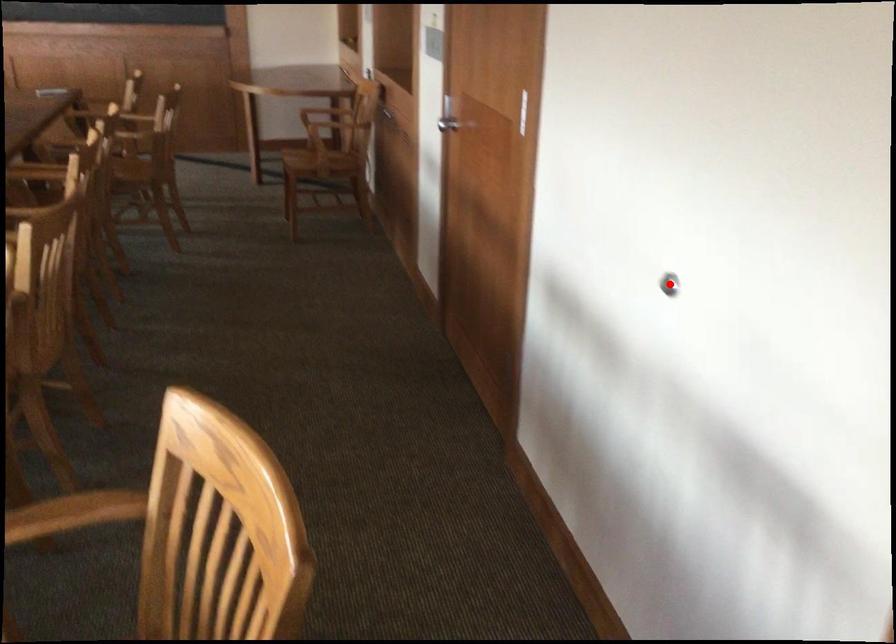
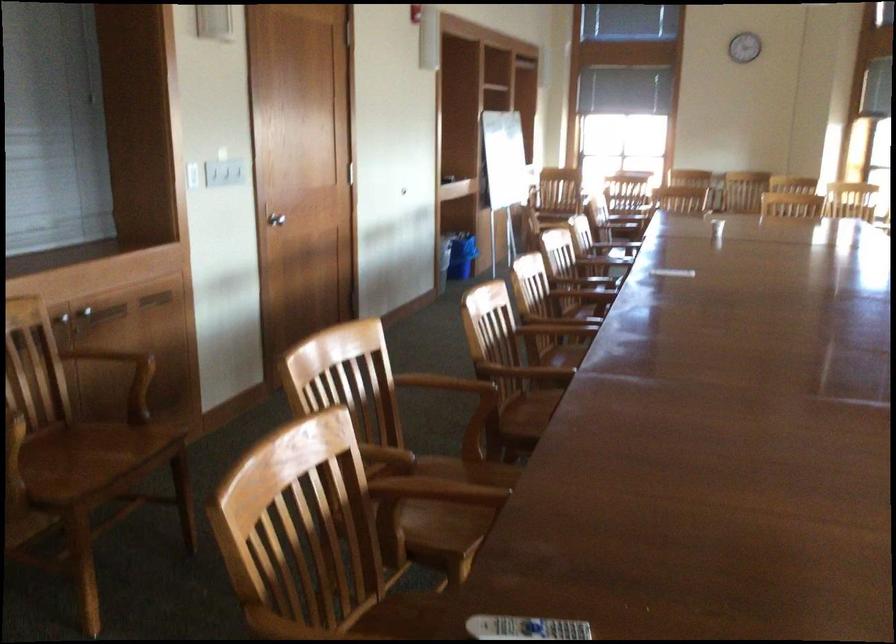
Question: I am providing you with two images of the same scene from different viewpoints. A red point is marked on the first image. Is the red point's position out of view in image 2?

Choices:
 (A) Yes
 (B) No

Answer: (A)